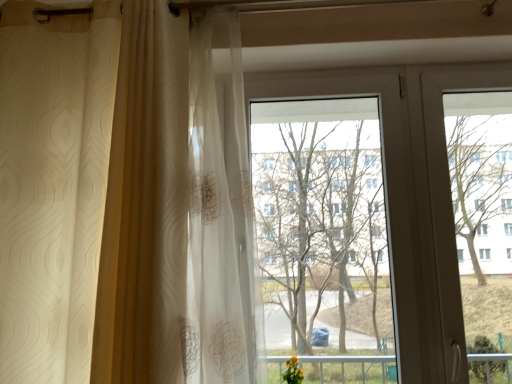
Question: Is transparent glass window at center not inside transparent plastic screen door at right?

Choices:
 (A) yes
 (B) no

Answer: (A)

Question: Does transparent glass window at center have a lesser width compared to transparent plastic screen door at right?

Choices:
 (A) yes
 (B) no

Answer: (B)

Question: Is transparent glass window at center to the right of transparent plastic screen door at right from the viewer's perspective?

Choices:
 (A) no
 (B) yes

Answer: (A)

Question: Is transparent glass window at center positioned before transparent plastic screen door at right?

Choices:
 (A) no
 (B) yes

Answer: (B)

Question: From the image's perspective, is transparent glass window at center below transparent plastic screen door at right?

Choices:
 (A) yes
 (B) no

Answer: (A)

Question: Looking at their shapes, would you say white sheer curtain at left is wider or thinner than transparent plastic screen door at right?

Choices:
 (A) wide
 (B) thin

Answer: (A)

Question: Based on their positions, is white sheer curtain at left located to the left or right of transparent plastic screen door at right?

Choices:
 (A) left
 (B) right

Answer: (A)

Question: Considering the positions of white sheer curtain at left and transparent plastic screen door at right in the image, is white sheer curtain at left taller or shorter than transparent plastic screen door at right?

Choices:
 (A) short
 (B) tall

Answer: (B)

Question: Is white sheer curtain at left inside the boundaries of transparent plastic screen door at right, or outside?

Choices:
 (A) inside
 (B) outside

Answer: (B)

Question: In terms of height, does transparent glass window at center look taller or shorter compared to transparent plastic screen door at right?

Choices:
 (A) tall
 (B) short

Answer: (A)

Question: Is transparent glass window at center bigger or smaller than transparent plastic screen door at right?

Choices:
 (A) small
 (B) big

Answer: (B)

Question: From the image's perspective, relative to transparent plastic screen door at right, is transparent glass window at center above or below?

Choices:
 (A) above
 (B) below

Answer: (B)

Question: Relative to transparent plastic screen door at right, is transparent glass window at center in front or behind?

Choices:
 (A) behind
 (B) front

Answer: (B)

Question: Would you say transparent glass window at center is inside or outside white sheer curtain at left?

Choices:
 (A) inside
 (B) outside

Answer: (B)

Question: From a real-world perspective, is transparent glass window at center physically located above or below white sheer curtain at left?

Choices:
 (A) above
 (B) below

Answer: (B)